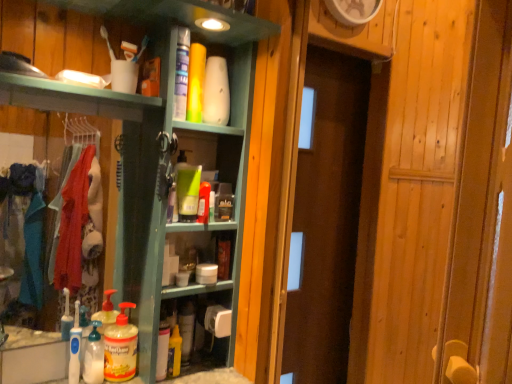
Question: Which direction should I rotate to look at yellow matte bottle at lower center, which ranks as the 6th cleaning product in left-to-right order?

Choices:
 (A) right
 (B) left

Answer: (B)

Question: Considering the relative positions of white matte toilet paper at lower center and yellow matte bottle at lower center, which ranks as the 6th cleaning product in left-to-right order, in the image provided, is white matte toilet paper at lower center to the right of yellow matte bottle at lower center, which ranks as the 6th cleaning product in left-to-right order, from the viewer's perspective?

Choices:
 (A) no
 (B) yes

Answer: (B)

Question: Is white matte toilet paper at lower center turned away from yellow matte bottle at lower center, which ranks as the 6th cleaning product in left-to-right order?

Choices:
 (A) no
 (B) yes

Answer: (A)

Question: Can you confirm if white matte toilet paper at lower center is smaller than yellow matte bottle at lower center, the second cleaning product positioned from the right?

Choices:
 (A) yes
 (B) no

Answer: (A)

Question: Does white matte toilet paper at lower center appear on the left side of yellow matte bottle at lower center, the second cleaning product positioned from the right?

Choices:
 (A) no
 (B) yes

Answer: (A)

Question: Does white matte toilet paper at lower center have a greater height compared to yellow matte bottle at lower center, which ranks as the 6th cleaning product in left-to-right order?

Choices:
 (A) yes
 (B) no

Answer: (B)

Question: Is white matte toilet paper at lower center closer to the viewer compared to yellow matte bottle at lower center, which ranks as the 6th cleaning product in left-to-right order?

Choices:
 (A) yes
 (B) no

Answer: (B)

Question: Are wooden door at center and translucent plastic bottle at lower left, the first cleaning product viewed from the left, located far from each other?

Choices:
 (A) yes
 (B) no

Answer: (A)

Question: From the image's perspective, does wooden door at center appear lower than translucent plastic bottle at lower left, the first cleaning product viewed from the left?

Choices:
 (A) yes
 (B) no

Answer: (B)

Question: Is the position of wooden door at center more distant than that of translucent plastic bottle at lower left, the first cleaning product viewed from the left?

Choices:
 (A) no
 (B) yes

Answer: (B)

Question: Is wooden door at center facing away from translucent plastic bottle at lower left, which is the seventh cleaning product from right to left?

Choices:
 (A) yes
 (B) no

Answer: (B)

Question: From the image's perspective, would you say wooden door at center is positioned over translucent plastic bottle at lower left, the first cleaning product viewed from the left?

Choices:
 (A) yes
 (B) no

Answer: (A)

Question: Is wooden door at center next to translucent plastic bottle at lower left, which is the seventh cleaning product from right to left, and touching it?

Choices:
 (A) yes
 (B) no

Answer: (B)

Question: Is wooden door at center located within yellow matte bottle at lower center, which ranks as the 6th cleaning product in left-to-right order?

Choices:
 (A) yes
 (B) no

Answer: (B)